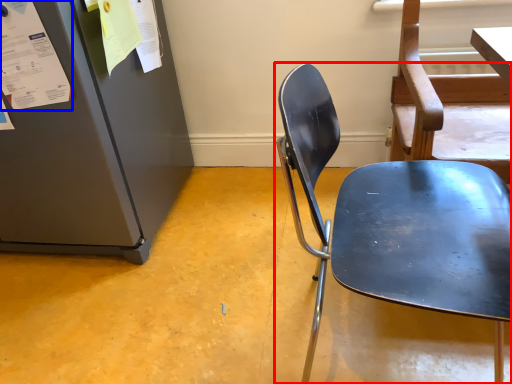
Question: Among these objects, which one is nearest to the camera, chair (highlighted by a red box) or paper (highlighted by a blue box)?

Choices:
 (A) chair
 (B) paper

Answer: (A)